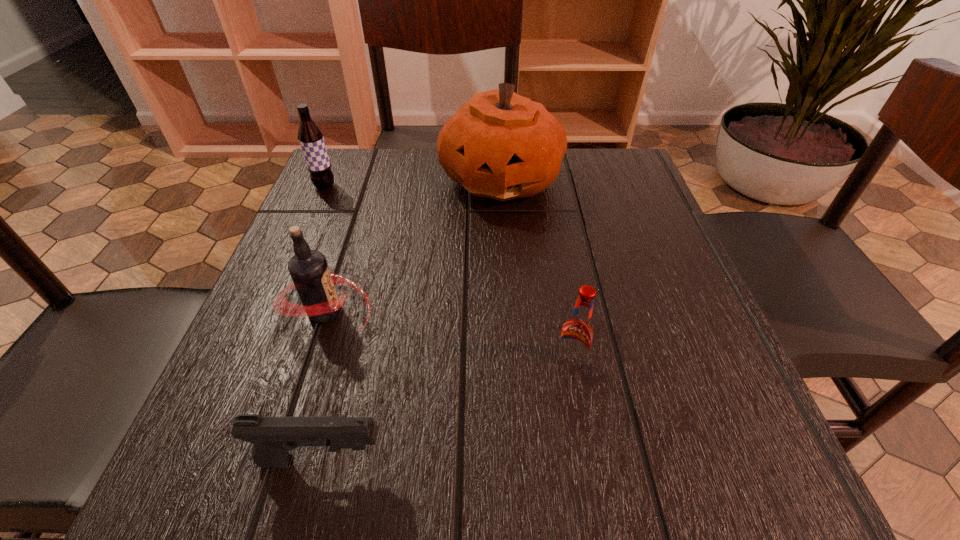
Locate an element on the screen. This screenshot has height=540, width=960. free space that satisfies the following two spatial constraints: 1. on the label of the rightmost root beer; 2. on the right side of the second nearest root beer is located at coordinates (309, 363).

Identify the location of free location that satisfies the following two spatial constraints: 1. on the front-facing side of the pumpkin; 2. on the label of the third nearest object. The width and height of the screenshot is (960, 540). (509, 311).

This screenshot has height=540, width=960. I want to click on free region that satisfies the following two spatial constraints: 1. on the front-facing side of the nearest root beer; 2. on the right side of the tallest object, so click(512, 363).